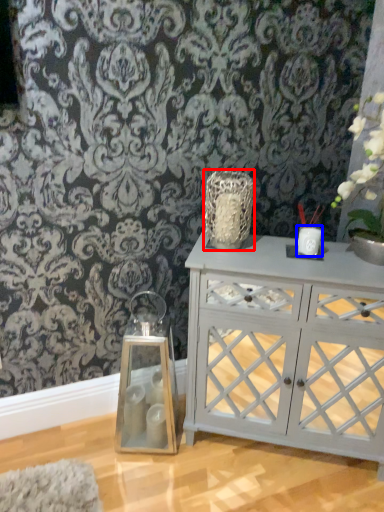
Question: Which point is further to the camera, vase (highlighted by a red box) or candle holder (highlighted by a blue box)?

Choices:
 (A) vase
 (B) candle holder

Answer: (B)